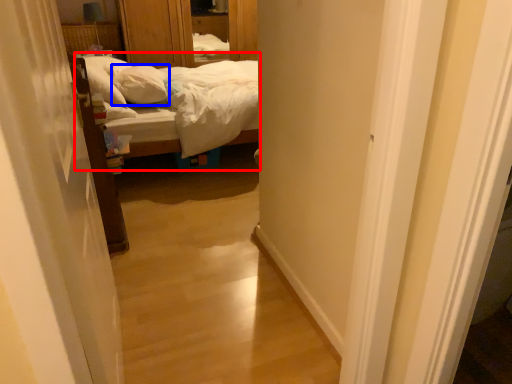
Question: Which of the following is the farthest to the observer, bed (highlighted by a red box) or pillow (highlighted by a blue box)?

Choices:
 (A) bed
 (B) pillow

Answer: (B)